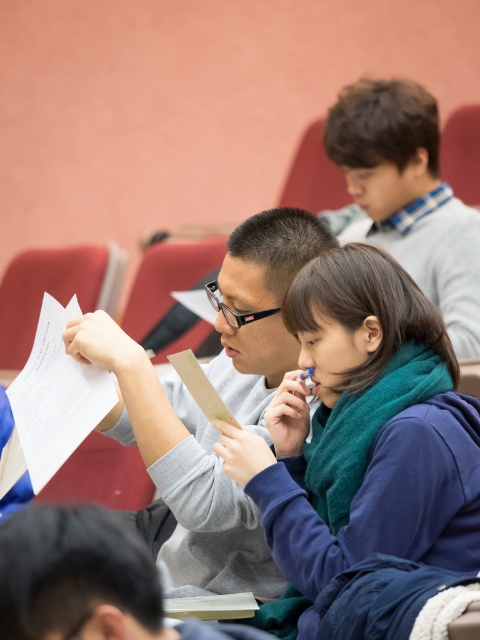
Which is below, blue fleece jacket at center or white paper at lower left?

blue fleece jacket at center is below.

Is blue fleece jacket at center shorter than white paper at lower left?

No.

Between point (368, 323) and point (0, 461), which one is positioned in front?

Point (368, 323) is more forward.

Locate an element on the screen. The image size is (480, 640). blue fleece jacket at center is located at coordinates (360, 435).

Based on the photo, who is higher up, gray matte sweater at center or light brown hair at upper right?

light brown hair at upper right is above.

Between point (287, 256) and point (372, 120), which one is positioned behind?

Point (372, 120)

Identify the location of gray matte sweater at center. The image size is (480, 640). (180, 468).

Find the location of a particular element. The height and width of the screenshot is (640, 480). gray matte sweater at center is located at coordinates (180, 468).

Between gray matte sweater at center and white paper at lower left, which one has less height?

Standing shorter between the two is white paper at lower left.

This screenshot has height=640, width=480. Find the location of `gray matte sweater at center`. gray matte sweater at center is located at coordinates (180, 468).